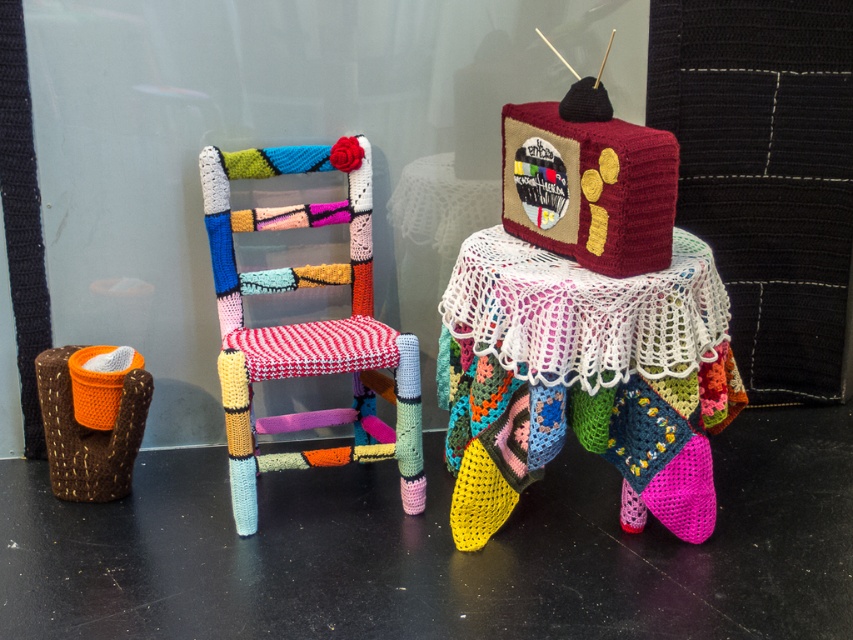
Question: Which of the following is the farthest from the observer?

Choices:
 (A) (321, 209)
 (B) (480, 464)

Answer: (A)

Question: Can you confirm if crochet fabric table at center is smaller than crochet multicolored chair at center?

Choices:
 (A) no
 (B) yes

Answer: (A)

Question: Is crochet fabric table at center positioned in front of maroon knitted tv at center?

Choices:
 (A) no
 (B) yes

Answer: (A)

Question: Among these points, which one is nearest to the camera?

Choices:
 (A) (341, 321)
 (B) (531, 310)
 (C) (553, 172)

Answer: (B)

Question: Which of these objects is positioned closest to the crochet multicolored chair at center?

Choices:
 (A) crochet fabric table at center
 (B) maroon knitted tv at center

Answer: (A)

Question: Is crochet multicolored chair at center below maroon knitted tv at center?

Choices:
 (A) no
 (B) yes

Answer: (B)